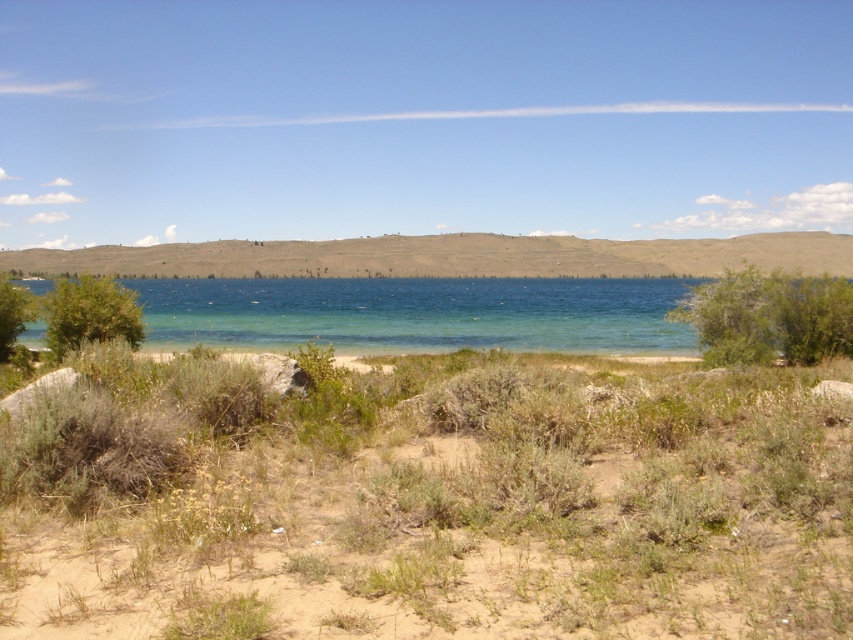
Question: Considering the relative positions of green leafy bush at left and green leafy bush at lower left in the image provided, where is green leafy bush at left located with respect to green leafy bush at lower left?

Choices:
 (A) above
 (B) below

Answer: (B)

Question: Which object appears closest to the camera in this image?

Choices:
 (A) green leafy bush at left
 (B) brown sandy soil at lower center
 (C) green leafy bush at right
 (D) green leafy bush at lower left

Answer: (B)

Question: Which point is farther to the camera?

Choices:
 (A) (700, 314)
 (B) (57, 339)
 (C) (695, 497)
 (D) (4, 340)

Answer: (D)

Question: Which object is farther from the camera taking this photo?

Choices:
 (A) brown sandy soil at lower center
 (B) green leafy bush at right

Answer: (B)

Question: Does green leafy bush at right appear over green leafy bush at left?

Choices:
 (A) no
 (B) yes

Answer: (A)

Question: Can you confirm if brown sandy soil at lower center is smaller than green leafy bush at lower left?

Choices:
 (A) no
 (B) yes

Answer: (A)